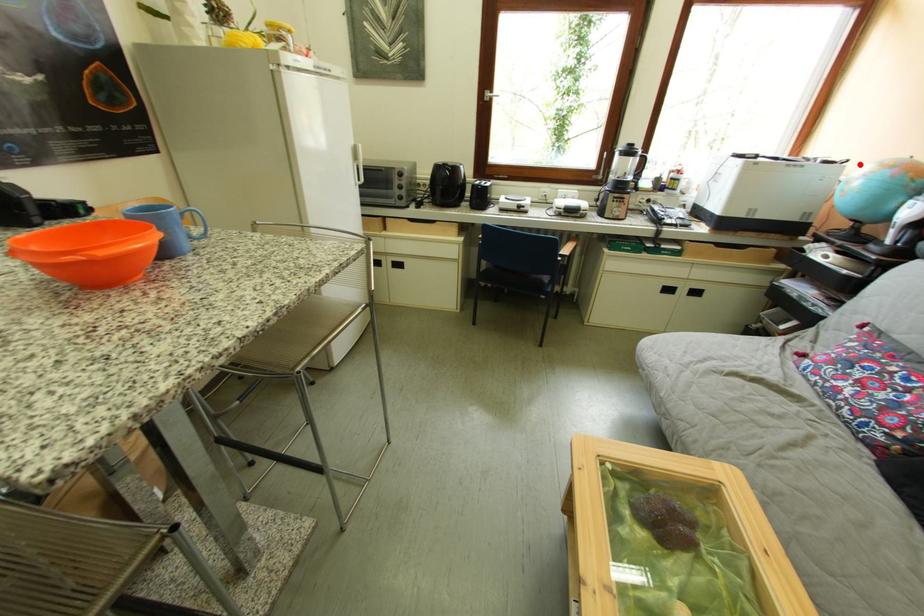
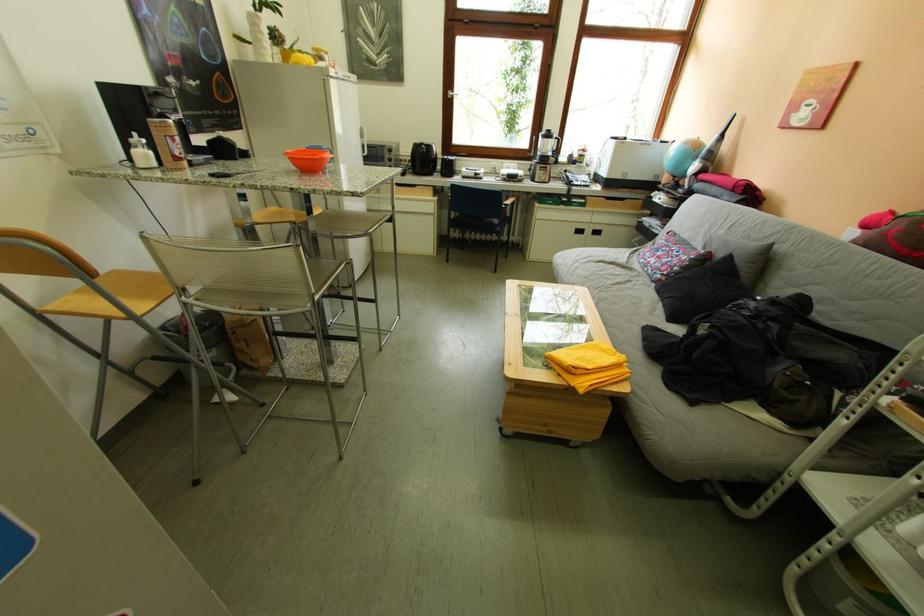
Question: I am providing you with two images of the same scene from different viewpoints. Given a red point in image1, look at the same physical point in image2. Is it:

Choices:
 (A) Closer to the viewpoint
 (B) Farther from the viewpoint

Answer: (A)